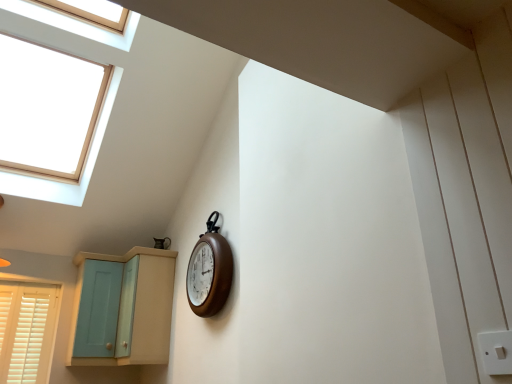
Where is `white plastic switch at lower right`? white plastic switch at lower right is located at coordinates (496, 352).

What do you see at coordinates (209, 271) in the screenshot?
I see `wooden clock at center` at bounding box center [209, 271].

Describe the element at coordinates (122, 308) in the screenshot. This screenshot has height=384, width=512. I see `light teal wood cabinet at lower left` at that location.

You are a GUI agent. You are given a task and a screenshot of the screen. Output one action in this format:
    pyautogui.click(x=<x>, y=<y>)
    Task: Click on the light blue wood cabinet at lower left
    
    Given the screenshot: What is the action you would take?
    point(98,309)

This screenshot has width=512, height=384. Find the location of `white plastic switch at lower right`. white plastic switch at lower right is located at coordinates click(x=496, y=352).

Considering the positions of objects light blue wood cabinet at lower left and light teal wood cabinet at lower left in the image provided, who is more to the left, light blue wood cabinet at lower left or light teal wood cabinet at lower left?

Positioned to the left is light blue wood cabinet at lower left.

Could you tell me if light blue wood cabinet at lower left is facing light teal wood cabinet at lower left?

Yes, light blue wood cabinet at lower left is turned towards light teal wood cabinet at lower left.

You are a GUI agent. You are given a task and a screenshot of the screen. Output one action in this format:
    pyautogui.click(x=<x>, y=<y>)
    Task: Click on the cabinetry that appears above the light blue wood cabinet at lower left (from the image's perspective)
    This screenshot has width=512, height=384.
    Given the screenshot: What is the action you would take?
    pyautogui.click(x=122, y=308)

Is light blue wood cabinet at lower left taller or shorter than light teal wood cabinet at lower left?

light blue wood cabinet at lower left is shorter than light teal wood cabinet at lower left.

Identify the location of electric outlet located in front of the wooden clock at center. The width and height of the screenshot is (512, 384). (496, 352).

Considering the positions of objects wooden clock at center and white plastic switch at lower right in the image provided, who is behind, wooden clock at center or white plastic switch at lower right?

wooden clock at center.

From a real-world perspective, does wooden clock at center stand above white plastic switch at lower right?

Correct, in the physical world, wooden clock at center is higher than white plastic switch at lower right.

From a real-world perspective, which is physically below, light teal wood cabinet at lower left or wooden clock at center?

In real-world perspective, light teal wood cabinet at lower left is lower.

Which object is more forward, light teal wood cabinet at lower left or wooden clock at center?

wooden clock at center is more forward.

From the image's perspective, between light teal wood cabinet at lower left and wooden clock at center, who is located below?

light teal wood cabinet at lower left.

Looking at this image, who is shorter, light teal wood cabinet at lower left or wooden clock at center?

wooden clock at center is shorter.

From a real-world perspective, is light blue wood cabinet at lower left located higher than white plastic switch at lower right?

Yes, from a real-world perspective, light blue wood cabinet at lower left is on top of white plastic switch at lower right.

Is the surface of light blue wood cabinet at lower left in direct contact with white plastic switch at lower right?

No, light blue wood cabinet at lower left is not making contact with white plastic switch at lower right.

Does point (109, 261) appear closer or farther from the camera than point (479, 348)?

Point (109, 261) is positioned farther from the camera compared to point (479, 348).

From a real-world perspective, between white plastic switch at lower right and light blue wood cabinet at lower left, who is vertically higher?

light blue wood cabinet at lower left.

Is light blue wood cabinet at lower left at the back of white plastic switch at lower right?

No, white plastic switch at lower right is not facing the opposite direction of light blue wood cabinet at lower left.

From the picture: Is white plastic switch at lower right not within light blue wood cabinet at lower left?

Yes, white plastic switch at lower right is not within light blue wood cabinet at lower left.

What's the angular difference between white plastic switch at lower right and light blue wood cabinet at lower left's facing directions?

The angular difference between white plastic switch at lower right and light blue wood cabinet at lower left is 81.5 degrees.

Between light teal wood cabinet at lower left and light blue wood cabinet at lower left, which one has less height?

With less height is light blue wood cabinet at lower left.

Does light teal wood cabinet at lower left have a larger size compared to light blue wood cabinet at lower left?

Indeed, light teal wood cabinet at lower left has a larger size compared to light blue wood cabinet at lower left.

Is light teal wood cabinet at lower left facing towards light blue wood cabinet at lower left?

Yes, light teal wood cabinet at lower left is turned towards light blue wood cabinet at lower left.

Can you confirm if light teal wood cabinet at lower left is wider than light blue wood cabinet at lower left?

Yes, light teal wood cabinet at lower left is wider than light blue wood cabinet at lower left.

Is wooden clock at center next to light teal wood cabinet at lower left?

wooden clock at center and light teal wood cabinet at lower left are clearly separated.

Based on the photo, considering the sizes of objects wooden clock at center and light teal wood cabinet at lower left in the image provided, who is shorter, wooden clock at center or light teal wood cabinet at lower left?

wooden clock at center.

Find the location of a particular element. The width and height of the screenshot is (512, 384). cabinetry below the wooden clock at center (from the image's perspective) is located at coordinates (122, 308).

The image size is (512, 384). What are the coordinates of `screen door behind the light teal wood cabinet at lower left` in the screenshot? It's located at 98,309.

Identify the location of clock that is on the left side of white plastic switch at lower right. The height and width of the screenshot is (384, 512). (209, 271).

When comparing their distances from wooden clock at center, does white plastic switch at lower right or light blue wood cabinet at lower left seem closer?

light blue wood cabinet at lower left is positioned closer to the anchor wooden clock at center.

Looking at the image, which one is located further to light blue wood cabinet at lower left, white plastic switch at lower right or wooden clock at center?

Among the two, white plastic switch at lower right is located further to light blue wood cabinet at lower left.

Based on their spatial positions, is light blue wood cabinet at lower left or white plastic switch at lower right closer to wooden clock at center?

The object closer to wooden clock at center is light blue wood cabinet at lower left.

From the image, which object appears to be farther from light teal wood cabinet at lower left, wooden clock at center or white plastic switch at lower right?

white plastic switch at lower right.

Based on their spatial positions, is light teal wood cabinet at lower left or wooden clock at center closer to light blue wood cabinet at lower left?

Based on the image, light teal wood cabinet at lower left appears to be nearer to light blue wood cabinet at lower left.

From the image, which object appears to be nearer to light teal wood cabinet at lower left, light blue wood cabinet at lower left or white plastic switch at lower right?

light blue wood cabinet at lower left is positioned closer to the anchor light teal wood cabinet at lower left.

When comparing their distances from light teal wood cabinet at lower left, does white plastic switch at lower right or wooden clock at center seem further?

white plastic switch at lower right is further to light teal wood cabinet at lower left.

Which object lies nearer to the anchor point light teal wood cabinet at lower left, white plastic switch at lower right or light blue wood cabinet at lower left?

light blue wood cabinet at lower left is closer to light teal wood cabinet at lower left.

At what (x,y) coordinates should I click in order to perform the action: click on clock between white plastic switch at lower right and light blue wood cabinet at lower left in the front-back direction. Please return your answer as a coordinate pair (x, y). The height and width of the screenshot is (384, 512). Looking at the image, I should click on (209, 271).

You are a GUI agent. You are given a task and a screenshot of the screen. Output one action in this format:
    pyautogui.click(x=<x>, y=<y>)
    Task: Click on the cabinetry between white plastic switch at lower right and light blue wood cabinet at lower left along the z-axis
    The image size is (512, 384).
    Given the screenshot: What is the action you would take?
    (x=122, y=308)

The width and height of the screenshot is (512, 384). What are the coordinates of `cabinetry located between light blue wood cabinet at lower left and wooden clock at center in the left-right direction` in the screenshot? It's located at (122, 308).

Locate an element on the screen. The height and width of the screenshot is (384, 512). clock positioned between white plastic switch at lower right and light teal wood cabinet at lower left from near to far is located at coordinates (209, 271).